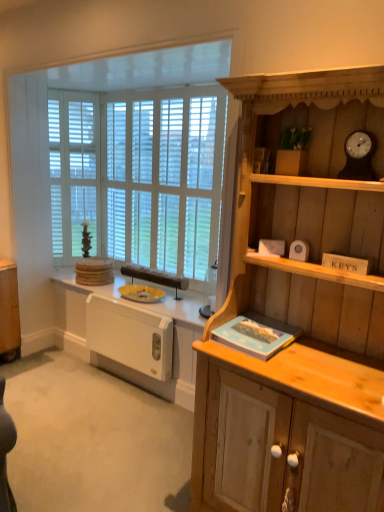
Question: Considering the positions of white plastic radiator at lower left and wooden clock at upper right in the image, is white plastic radiator at lower left wider or thinner than wooden clock at upper right?

Choices:
 (A) wide
 (B) thin

Answer: (A)

Question: Considering their positions, is white plastic radiator at lower left located in front of or behind wooden clock at upper right?

Choices:
 (A) front
 (B) behind

Answer: (B)

Question: Which is farther from the white matte radiator at lower left?

Choices:
 (A) white plastic radiator at lower left
 (B) white wooden window at upper left
 (C) wooden clock at upper right
 (D) white wood blinds at left
 (E) light wood cabinet at right

Answer: (C)

Question: Which object is positioned farthest from the white wooden window at upper left?

Choices:
 (A) white plastic radiator at lower left
 (B) wooden clock at upper right
 (C) white wooden blinds at center
 (D) light wood cabinet at right
 (E) white matte radiator at lower left

Answer: (B)